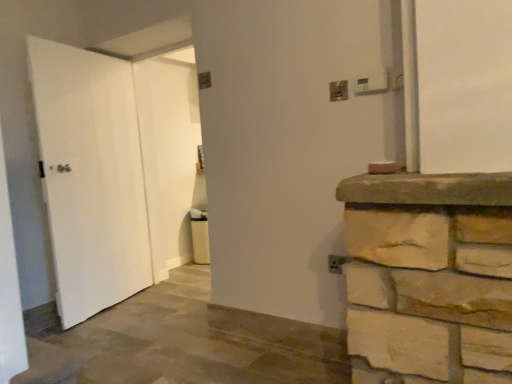
Question: Which direction should I rotate to face metallic silver electric outlet at upper center, which is counted as the second electric outlet, starting from the front, — up or down?

Choices:
 (A) down
 (B) up

Answer: (B)

Question: From a real-world perspective, is white matte door at center, the 1th door positioned from the right, physically above metallic silver electric outlet at upper right, positioned as the first electric outlet in front-to-back order?

Choices:
 (A) no
 (B) yes

Answer: (A)

Question: Can you confirm if white matte door at center, positioned as the second door in left-to-right order, is bigger than metallic silver electric outlet at upper right, acting as the second electric outlet starting from the left?

Choices:
 (A) yes
 (B) no

Answer: (A)

Question: Is white matte door at center, the 1th door positioned from the right, smaller than metallic silver electric outlet at upper right, acting as the second electric outlet starting from the left?

Choices:
 (A) no
 (B) yes

Answer: (A)

Question: Is white matte door at center, positioned as the second door in left-to-right order, turned away from metallic silver electric outlet at upper right, positioned as the first electric outlet in front-to-back order?

Choices:
 (A) no
 (B) yes

Answer: (A)

Question: From a real-world perspective, is white matte door at center, the 1th door positioned from the right, physically below metallic silver electric outlet at upper right, the second electric outlet when ordered from back to front?

Choices:
 (A) yes
 (B) no

Answer: (A)

Question: Is white matte door at center, the 1th door positioned from the right, located outside metallic silver electric outlet at upper right, the 1th electric outlet viewed from the right?

Choices:
 (A) yes
 (B) no

Answer: (A)

Question: Could you tell me if white matte door at left, positioned as the 1th door in left-to-right order, is facing white matte door at center, the 1th door positioned from the right?

Choices:
 (A) no
 (B) yes

Answer: (B)

Question: Considering the relative sizes of white matte door at left, positioned as the 1th door in left-to-right order, and white matte door at center, positioned as the second door in left-to-right order, in the image provided, is white matte door at left, positioned as the 1th door in left-to-right order, taller than white matte door at center, positioned as the second door in left-to-right order,?

Choices:
 (A) no
 (B) yes

Answer: (A)

Question: Would you say white matte door at left, which is the 2th door from right to left, contains white matte door at center, positioned as the second door in left-to-right order?

Choices:
 (A) no
 (B) yes

Answer: (A)

Question: Is white matte door at left, which is the 2th door from right to left, wider than white matte door at center, the 1th door positioned from the right?

Choices:
 (A) no
 (B) yes

Answer: (A)

Question: Considering the relative sizes of white matte door at left, which is the 2th door from right to left, and white matte door at center, the 1th door positioned from the right, in the image provided, is white matte door at left, which is the 2th door from right to left, bigger than white matte door at center, the 1th door positioned from the right,?

Choices:
 (A) yes
 (B) no

Answer: (B)

Question: Is white matte door at left, positioned as the 1th door in left-to-right order, next to white matte door at center, positioned as the second door in left-to-right order?

Choices:
 (A) no
 (B) yes

Answer: (A)

Question: Is metallic silver electric outlet at upper center, which is counted as the second electric outlet, starting from the front, placed right next to metallic silver electric outlet at upper right, the second electric outlet when ordered from back to front?

Choices:
 (A) no
 (B) yes

Answer: (A)